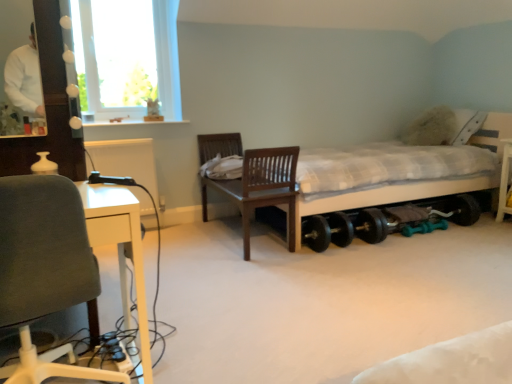
Question: Looking at their shapes, would you say gray fabric chair at left, the first chair when ordered from front to back, is wider or thinner than white checkered bed at center?

Choices:
 (A) wide
 (B) thin

Answer: (B)

Question: Which is correct: gray fabric chair at left, the first chair when ordered from front to back, is inside white checkered bed at center, or outside of it?

Choices:
 (A) inside
 (B) outside

Answer: (B)

Question: Based on their relative distances, which object is nearer to the white glass window at upper left?

Choices:
 (A) wooden chair at center, which is the second chair in left-to-right order
 (B) white matte sweater at upper left
 (C) black rubber wheel at lower center
 (D) white checkered bed at center
 (E) gray fabric chair at left, positioned as the second chair in right-to-left order

Answer: (A)

Question: Which object is positioned farthest from the white matte sweater at upper left?

Choices:
 (A) white glass window at upper left
 (B) black rubber wheel at lower center
 (C) gray fabric chair at left, arranged as the 2th chair when viewed from the back
 (D) wooden chair at center, the first chair from the back
 (E) white checkered bed at center

Answer: (B)